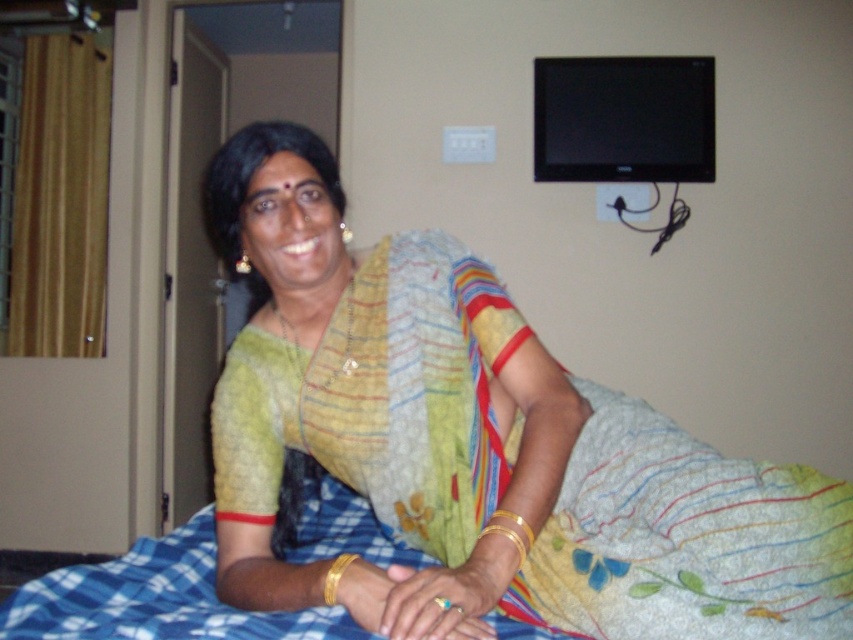
In the scene shown: You are a photographer standing in the room and want to take a closeup shot of the matte yellow sari at center. The camera you are using has a minimum focusing distance of 30 inches. Can you take the closeup without moving the camera or the sari?

The matte yellow sari at center and camera are 33.39 inches apart from each other. Since the minimum focusing distance is 30 inches, the camera can focus on the matte yellow sari at center as the distance is within the required range.